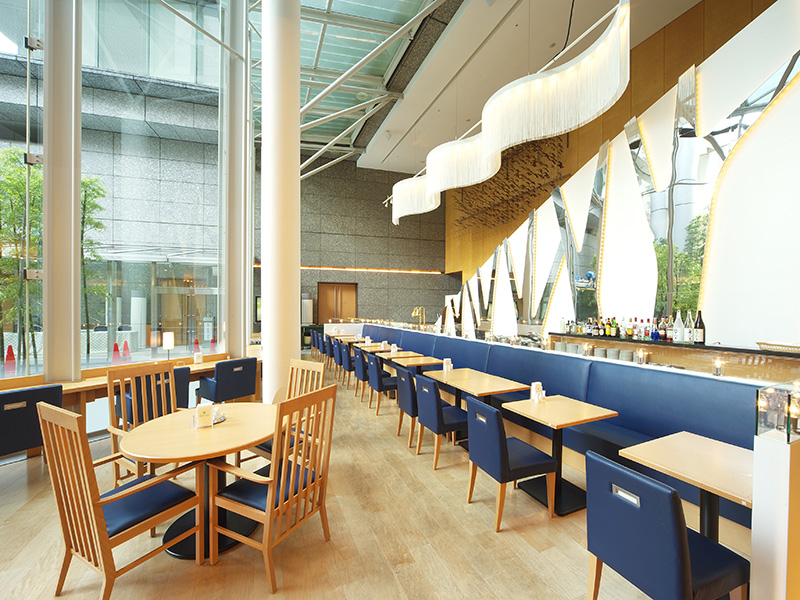
Where is `bench sections`? The width and height of the screenshot is (800, 600). bench sections is located at coordinates (642, 396), (534, 362), (454, 350), (410, 341), (390, 333), (366, 330).